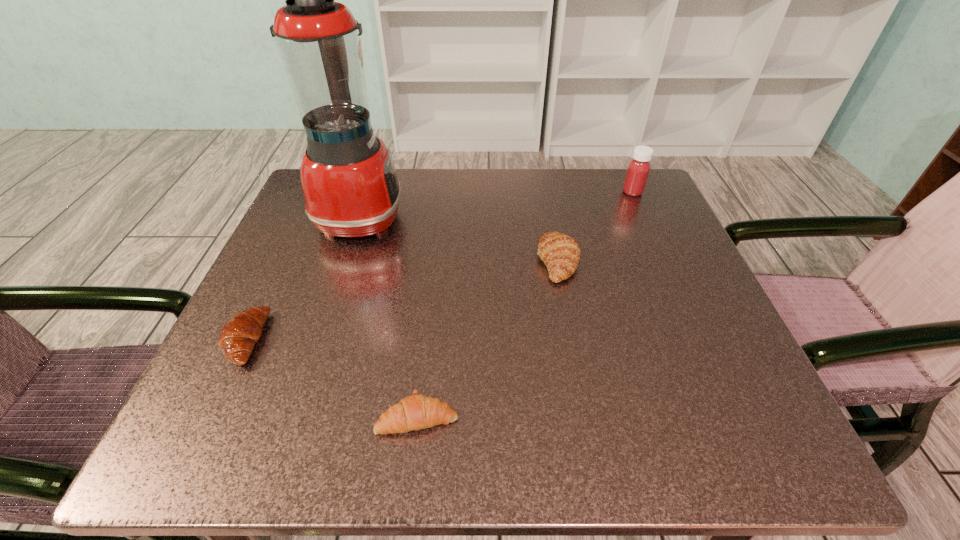
Identify the location of vacant area situated on the left of the rightmost object. The width and height of the screenshot is (960, 540). (x=558, y=192).

Where is `vacant space located 0.350m on the left of the second object from right to left`? The width and height of the screenshot is (960, 540). vacant space located 0.350m on the left of the second object from right to left is located at coordinates pos(355,261).

The image size is (960, 540). In order to click on blank space located on the right of the leftmost crescent roll in this screenshot , I will do `click(423, 339)`.

What are the coordinates of `vacant space located on the right of the third object from left to right` in the screenshot? It's located at (650, 416).

At what (x,y) coordinates should I click in order to perform the action: click on food processor that is positioned at the far edge. Please return your answer as a coordinate pair (x, y). This screenshot has width=960, height=540. Looking at the image, I should click on (349, 182).

The height and width of the screenshot is (540, 960). I want to click on medicine that is positioned at the far edge, so click(x=638, y=169).

Where is `object that is at the near edge`? object that is at the near edge is located at coordinates (415, 412).

You are a GUI agent. You are given a task and a screenshot of the screen. Output one action in this format:
    pyautogui.click(x=<x>, y=<y>)
    Task: Click on the food processor that is at the left edge
    The height and width of the screenshot is (540, 960).
    Given the screenshot: What is the action you would take?
    pyautogui.click(x=349, y=182)

The width and height of the screenshot is (960, 540). Identify the location of crescent roll situated at the left edge. (240, 333).

The height and width of the screenshot is (540, 960). What are the coordinates of `object that is positioned at the right edge` in the screenshot? It's located at (638, 169).